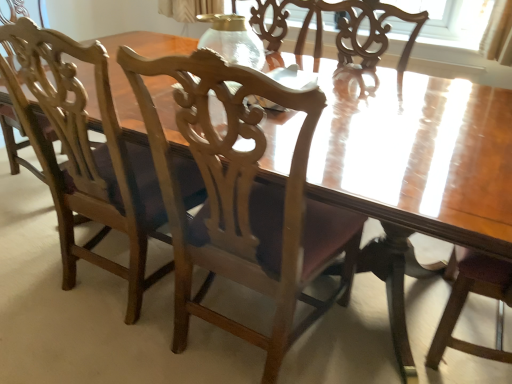
The image size is (512, 384). Identify the location of wooden chair at center, which ranks as the first chair in right-to-left order. (243, 200).

Image resolution: width=512 pixels, height=384 pixels. Find the location of `wooden chair at left, placed as the 2th chair when sorted from right to left`. wooden chair at left, placed as the 2th chair when sorted from right to left is located at coordinates 86,156.

How different are the orientations of transparent glass vase at center and wooden chair at center, the 2th chair from the left, in degrees?

The angular difference between transparent glass vase at center and wooden chair at center, the 2th chair from the left, is 175 degrees.

Between point (257, 48) and point (244, 337), which one is positioned behind?

The point (257, 48) is farther.

Choose the correct answer: Is transparent glass vase at center inside wooden chair at center, which ranks as the first chair in right-to-left order, or outside it?

transparent glass vase at center is spatially situated outside wooden chair at center, which ranks as the first chair in right-to-left order.

Is transparent glass vase at center taller than wooden chair at center, which ranks as the first chair in right-to-left order?

Incorrect, the height of transparent glass vase at center is not larger of that of wooden chair at center, which ranks as the first chair in right-to-left order.

From a real-world perspective, does wooden chair at center, which ranks as the first chair in right-to-left order, stand above transparent glass vase at center?

No, from a real-world perspective, wooden chair at center, which ranks as the first chair in right-to-left order, is not above transparent glass vase at center.

In the image, is wooden chair at center, which ranks as the first chair in right-to-left order, positioned in front of or behind transparent glass vase at center?

wooden chair at center, which ranks as the first chair in right-to-left order, is in front of transparent glass vase at center.

Is wooden chair at center, which ranks as the first chair in right-to-left order, to the left or to the right of transparent glass vase at center in the image?

In the image, wooden chair at center, which ranks as the first chair in right-to-left order, appears on the right side of transparent glass vase at center.

Would you say wooden chair at center, the 2th chair from the left, is a long distance from transparent glass vase at center?

That's not correct — wooden chair at center, the 2th chair from the left, is a little close to transparent glass vase at center.

Between wooden chair at center, which ranks as the first chair in right-to-left order, and wooden chair at left, which is the 1th chair in left-to-right order, which one is positioned in front?

wooden chair at center, which ranks as the first chair in right-to-left order, is closer to the camera.

Is wooden chair at center, which ranks as the first chair in right-to-left order, oriented away from wooden chair at left, which is the 1th chair in left-to-right order?

No, wooden chair at center, which ranks as the first chair in right-to-left order,'s orientation is not away from wooden chair at left, which is the 1th chair in left-to-right order.

Locate an element on the screen. The height and width of the screenshot is (384, 512). chair lying in front of the wooden chair at left, which is the 1th chair in left-to-right order is located at coordinates (243, 200).

Is wooden chair at left, which is the 1th chair in left-to-right order, positioned in front of wooden chair at center, which ranks as the first chair in right-to-left order?

No, it is behind wooden chair at center, which ranks as the first chair in right-to-left order.

Can you confirm if wooden chair at left, which is the 1th chair in left-to-right order, is shorter than wooden chair at center, the 2th chair from the left?

No.

Considering the positions of objects wooden chair at left, placed as the 2th chair when sorted from right to left, and wooden chair at center, the 2th chair from the left, in the image provided, who is more to the left, wooden chair at left, placed as the 2th chair when sorted from right to left, or wooden chair at center, the 2th chair from the left,?

wooden chair at left, placed as the 2th chair when sorted from right to left.

From the image's perspective, relative to wooden chair at center, the 2th chair from the left, is wooden chair at left, which is the 1th chair in left-to-right order, above or below?

Clearly, from the image's perspective, wooden chair at left, which is the 1th chair in left-to-right order, is above wooden chair at center, the 2th chair from the left.

Is transparent glass vase at center facing towards wooden chair at left, which is the 1th chair in left-to-right order?

Yes, transparent glass vase at center is oriented towards wooden chair at left, which is the 1th chair in left-to-right order.

How much distance is there between transparent glass vase at center and wooden chair at left, which is the 1th chair in left-to-right order?

transparent glass vase at center is 56.44 centimeters from wooden chair at left, which is the 1th chair in left-to-right order.

Based on the photo, is transparent glass vase at center placed right next to wooden chair at left, which is the 1th chair in left-to-right order?

No, transparent glass vase at center is not next to wooden chair at left, which is the 1th chair in left-to-right order.

Consider the image. From the image's perspective, is transparent glass vase at center located above wooden chair at left, which is the 1th chair in left-to-right order?

Yes.

Where is `chair on the left of transparent glass vase at center`? This screenshot has width=512, height=384. chair on the left of transparent glass vase at center is located at coordinates (86, 156).

Is wooden chair at left, placed as the 2th chair when sorted from right to left, inside or outside of transparent glass vase at center?

wooden chair at left, placed as the 2th chair when sorted from right to left, is outside transparent glass vase at center.

From a real-world perspective, is wooden chair at left, placed as the 2th chair when sorted from right to left, under transparent glass vase at center?

Correct, in the physical world, wooden chair at left, placed as the 2th chair when sorted from right to left, is lower than transparent glass vase at center.

From a real-world perspective, starting from the transparent glass vase at center, which chair is the 2nd one below it? Please provide its 2D coordinates.

[(243, 200)]

From the image's perspective, starting from the transparent glass vase at center, which chair is the 2nd one below? Please provide its 2D coordinates.

[(243, 200)]

Which object lies nearer to the anchor point wooden chair at left, which is the 1th chair in left-to-right order, wooden chair at center, which ranks as the first chair in right-to-left order, or transparent glass vase at center?

wooden chair at center, which ranks as the first chair in right-to-left order.

When comparing their distances from wooden chair at left, which is the 1th chair in left-to-right order, does transparent glass vase at center or wooden chair at center, the 2th chair from the left, seem closer?

wooden chair at center, the 2th chair from the left, lies closer to wooden chair at left, which is the 1th chair in left-to-right order, than the other object.

Based on their spatial positions, is wooden chair at center, the 2th chair from the left, or wooden chair at left, placed as the 2th chair when sorted from right to left, closer to transparent glass vase at center?

wooden chair at center, the 2th chair from the left.

From the image, which object appears to be nearer to wooden chair at center, which ranks as the first chair in right-to-left order, transparent glass vase at center or wooden chair at left, which is the 1th chair in left-to-right order?

wooden chair at left, which is the 1th chair in left-to-right order, is closer to wooden chair at center, which ranks as the first chair in right-to-left order.

When comparing their distances from transparent glass vase at center, does wooden chair at left, placed as the 2th chair when sorted from right to left, or wooden chair at center, the 2th chair from the left, seem further?

wooden chair at left, placed as the 2th chair when sorted from right to left, is further to transparent glass vase at center.

From the image, which object appears to be farther from wooden chair at center, which ranks as the first chair in right-to-left order, wooden chair at left, placed as the 2th chair when sorted from right to left, or transparent glass vase at center?

The object further to wooden chair at center, which ranks as the first chair in right-to-left order, is transparent glass vase at center.

The height and width of the screenshot is (384, 512). Identify the location of chair between wooden chair at center, which ranks as the first chair in right-to-left order, and transparent glass vase at center from front to back. (86, 156).